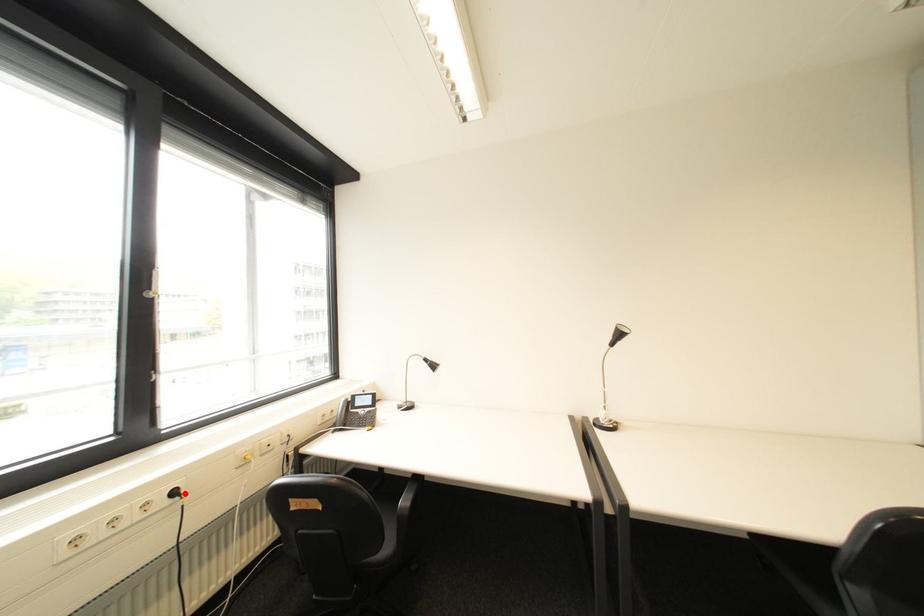
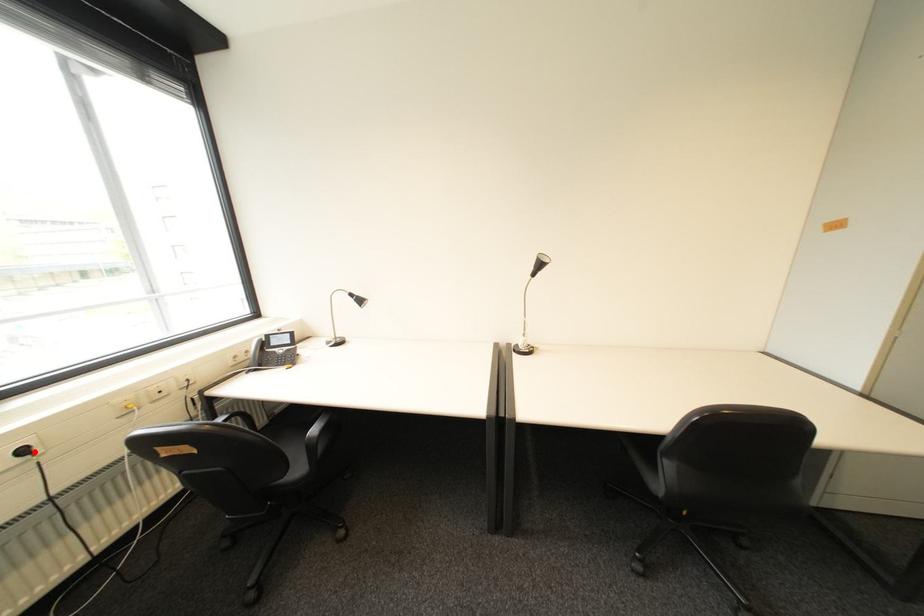
I am providing you with two images of the same scene from different viewpoints. A red point is marked on the first image and another point is marked on the second image. Is the marked point in image1 the same physical position as the marked point in image2?

Yes